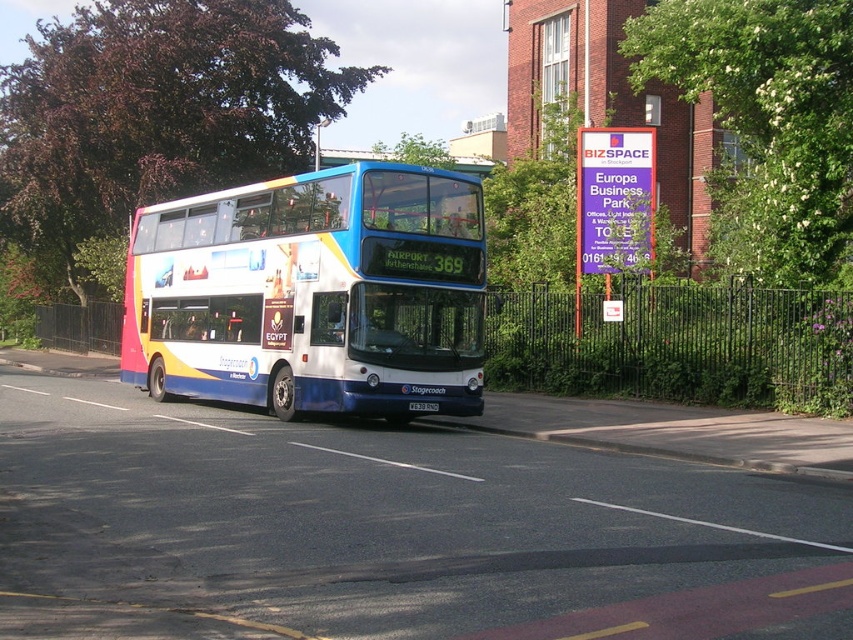
Question: Can you confirm if white glossy double-decker bus at center is wider than purple sign at upper center?

Choices:
 (A) no
 (B) yes

Answer: (B)

Question: Which point is closer to the camera?

Choices:
 (A) silver metallic license plate at center
 (B) purple sign at upper center

Answer: (A)

Question: Which point is closer to the camera taking this photo?

Choices:
 (A) (332, 333)
 (B) (582, 182)
 (C) (422, 404)

Answer: (A)

Question: Does white glossy double-decker bus at center have a greater width compared to silver metallic license plate at center?

Choices:
 (A) no
 (B) yes

Answer: (B)

Question: Among these points, which one is farthest from the camera?

Choices:
 (A) [x=177, y=342]
 (B) [x=596, y=241]
 (C) [x=422, y=406]

Answer: (B)

Question: Does white glossy double-decker bus at center appear on the right side of silver metallic license plate at center?

Choices:
 (A) yes
 (B) no

Answer: (B)